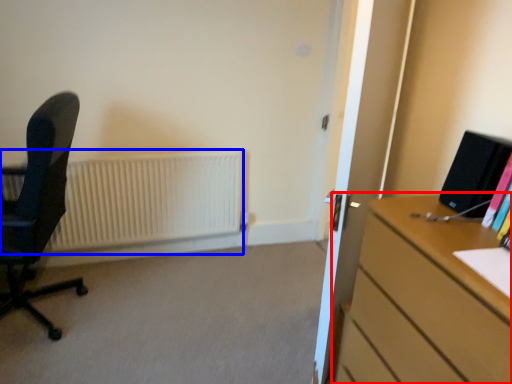
Question: Which object is closer to the camera taking this photo, desk (highlighted by a red box) or radiator (highlighted by a blue box)?

Choices:
 (A) desk
 (B) radiator

Answer: (A)